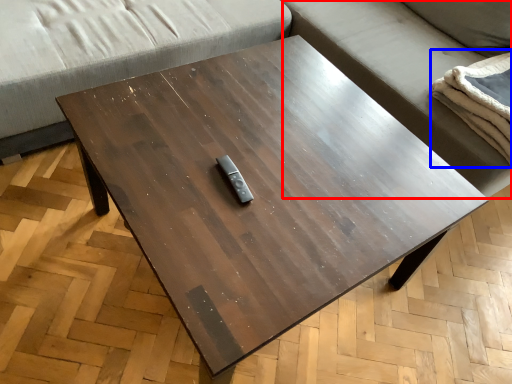
Question: Which object is closer to the camera taking this photo, couch (highlighted by a red box) or blanket (highlighted by a blue box)?

Choices:
 (A) couch
 (B) blanket

Answer: (A)